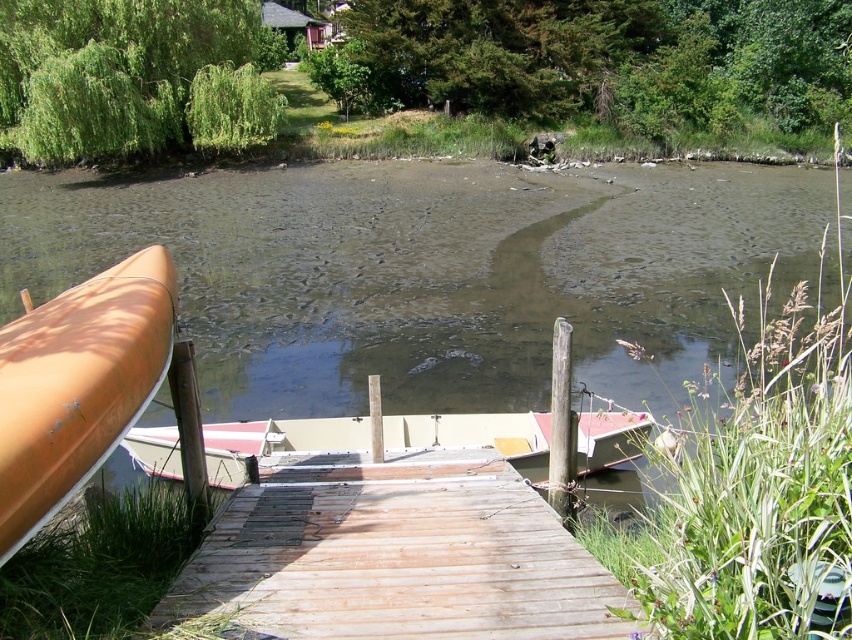
Is brown murky water at center above matte orange canoe at left?

Correct, brown murky water at center is located above matte orange canoe at left.

Does brown murky water at center have a lesser width compared to matte orange canoe at left?

No.

Locate an element on the screen. The width and height of the screenshot is (852, 640). brown murky water at center is located at coordinates (430, 275).

Where is `brown murky water at center`? brown murky water at center is located at coordinates (430, 275).

Does matte orange canoe at left have a lesser width compared to white matte boat at center?

Correct, matte orange canoe at left's width is less than white matte boat at center's.

Is matte orange canoe at left shorter than white matte boat at center?

Incorrect, matte orange canoe at left's height does not fall short of white matte boat at center's.

Between point (160, 244) and point (353, 465), which one is positioned in front?

Positioned in front is point (353, 465).

The width and height of the screenshot is (852, 640). I want to click on matte orange canoe at left, so click(78, 385).

Is brown murky water at center wider than white matte boat at center?

Yes.

Find the location of a particular element. The width and height of the screenshot is (852, 640). brown murky water at center is located at coordinates (430, 275).